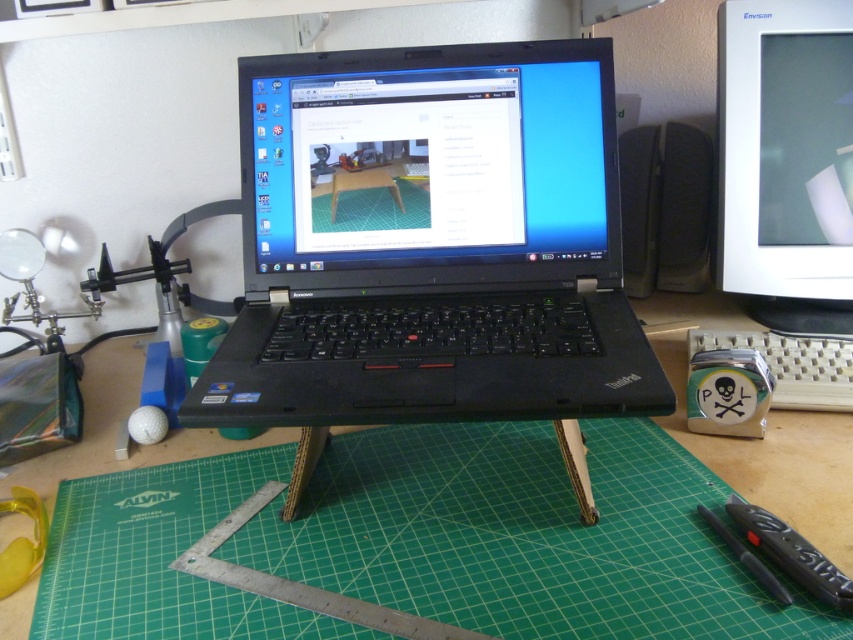
Question: Among these objects, which one is farthest from the camera?

Choices:
 (A) white glossy monitor at upper right
 (B) green cutting mat at center

Answer: (A)

Question: Which point is farther from the camera taking this photo?

Choices:
 (A) (413, 186)
 (B) (729, 445)
 (C) (840, 42)

Answer: (C)

Question: Can you confirm if black plastic laptop at center is smaller than green cutting mat at center?

Choices:
 (A) no
 (B) yes

Answer: (A)

Question: Is black plastic laptop at center below green cutting mat at center?

Choices:
 (A) yes
 (B) no

Answer: (B)

Question: Is white glossy monitor at upper right closer to the viewer compared to green cutting mat at center?

Choices:
 (A) no
 (B) yes

Answer: (A)

Question: Which of the following is the closest to the observer?

Choices:
 (A) (828, 449)
 (B) (844, 252)
 (C) (283, 216)

Answer: (A)